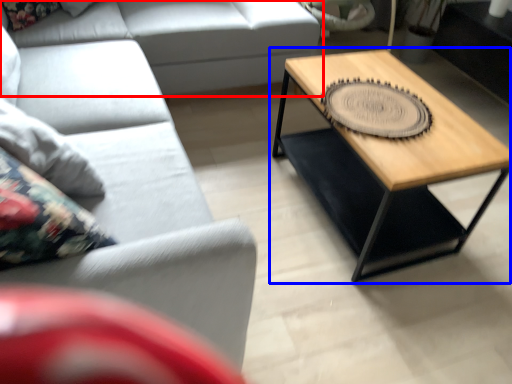
Question: Which point is closer to the camera, studio couch (highlighted by a red box) or coffee table (highlighted by a blue box)?

Choices:
 (A) studio couch
 (B) coffee table

Answer: (B)